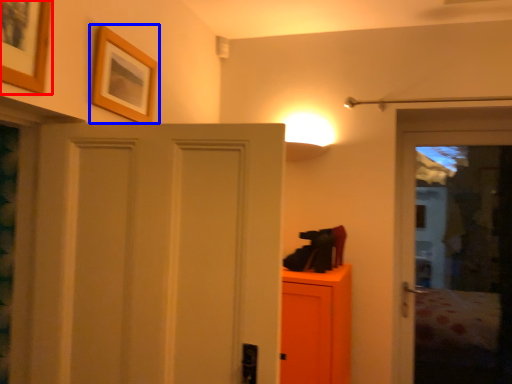
Question: Which object is closer to the camera taking this photo, picture frame (highlighted by a red box) or picture frame (highlighted by a blue box)?

Choices:
 (A) picture frame
 (B) picture frame

Answer: (A)